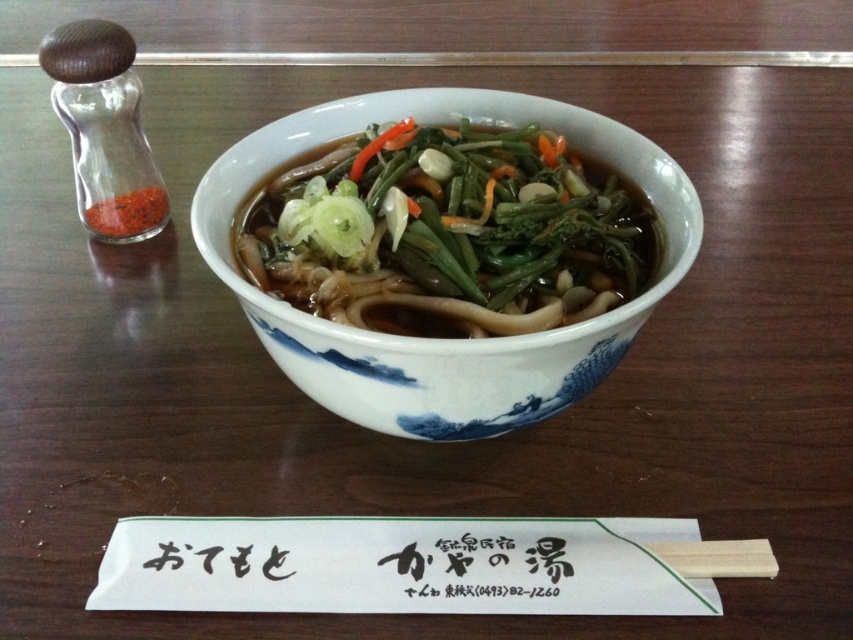
Describe the element at coordinates (448, 232) in the screenshot. The width and height of the screenshot is (853, 640). I see `white glossy bowl at center` at that location.

What do you see at coordinates (448, 232) in the screenshot? I see `white glossy bowl at center` at bounding box center [448, 232].

Image resolution: width=853 pixels, height=640 pixels. In order to click on white glossy bowl at center in this screenshot , I will do `click(448, 232)`.